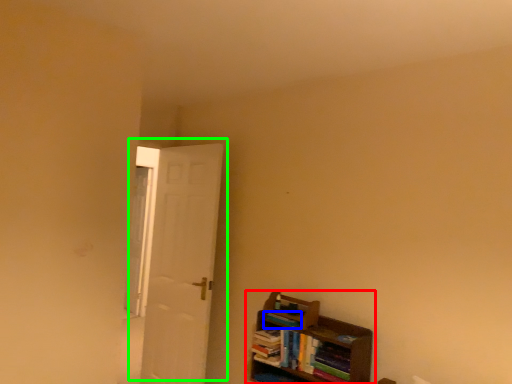
Question: Considering the real-world distances, which object is closest to shelf (highlighted by a red box)? book (highlighted by a blue box) or door (highlighted by a green box).

Choices:
 (A) book
 (B) door

Answer: (A)